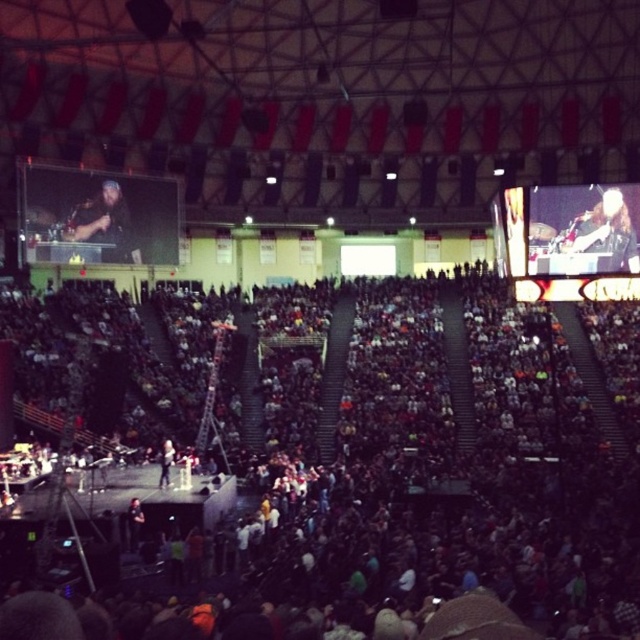
You are a photographer standing at the back of the arena and want to take a clear photo of the shiny silver guitar at upper right. Considering the distance between you and the guitar, is it feasible to capture a sharp image without using a zoom lens?

The distance between you and the shiny silver guitar at upper right is 78.67 meters. Without a zoom lens, capturing a sharp image from this distance would be extremely challenging due to the limited focal length of standard lenses. It is highly recommended to use a zoom lens or move closer for a clearer shot.

You are a photographer at the concert and want to capture a photo of both the shiny silver guitar at upper right and the bearded man with microphone at upper left in the same frame. Based on their heights, which one should you focus on first to ensure both are in the shot?

The shiny silver guitar at upper right is not as tall as the bearded man with microphone at upper left, so you should focus on the taller bearded man with microphone at upper left first to ensure both are in the shot.

You are a photographer positioned at the origin point of the coordinate system in the arena. You want to capture a photo of the dark gray crowd at center. What are the coordinates where you should aim your camera?

The coordinates to aim your camera are at point (x=438, y=474) to capture the dark gray crowd at center.